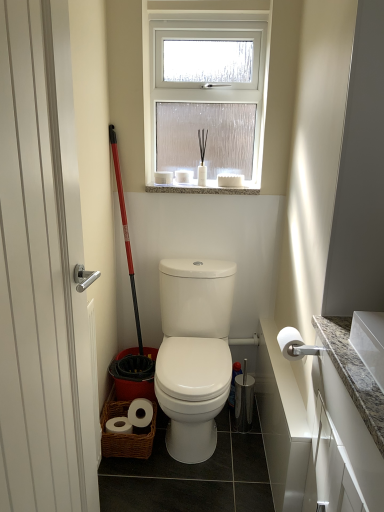
Question: Can you confirm if white matte toilet paper at right is shorter than white granite countertop at right?

Choices:
 (A) yes
 (B) no

Answer: (A)

Question: Is white matte toilet paper at right taller than white granite countertop at right?

Choices:
 (A) yes
 (B) no

Answer: (B)

Question: Does white matte toilet paper at right lie in front of white granite countertop at right?

Choices:
 (A) yes
 (B) no

Answer: (B)

Question: From a real-world perspective, is white matte toilet paper at right over white granite countertop at right?

Choices:
 (A) yes
 (B) no

Answer: (A)

Question: Is the position of white matte toilet paper at right more distant than that of white granite countertop at right?

Choices:
 (A) no
 (B) yes

Answer: (B)

Question: Considering the positions of white matte toilet paper at right and granite at upper center in the image, is white matte toilet paper at right bigger or smaller than granite at upper center?

Choices:
 (A) small
 (B) big

Answer: (A)

Question: Considering the relative positions of white matte toilet paper at right and granite at upper center in the image provided, is white matte toilet paper at right to the left or to the right of granite at upper center?

Choices:
 (A) right
 (B) left

Answer: (A)

Question: In terms of height, does white matte toilet paper at right look taller or shorter compared to granite at upper center?

Choices:
 (A) short
 (B) tall

Answer: (B)

Question: From the image's perspective, is white matte toilet paper at right positioned above or below granite at upper center?

Choices:
 (A) above
 (B) below

Answer: (B)

Question: Considering their positions, is granite at upper center located in front of or behind white matte toilet paper at right?

Choices:
 (A) front
 (B) behind

Answer: (B)

Question: Considering the positions of granite at upper center and white matte toilet paper at right in the image, is granite at upper center bigger or smaller than white matte toilet paper at right?

Choices:
 (A) small
 (B) big

Answer: (B)

Question: Is granite at upper center taller or shorter than white matte toilet paper at right?

Choices:
 (A) tall
 (B) short

Answer: (B)

Question: Considering the positions of point (162, 187) and point (279, 338), is point (162, 187) closer or farther from the camera than point (279, 338)?

Choices:
 (A) farther
 (B) closer

Answer: (A)

Question: In terms of width, does red plastic ski pole at left look wider or thinner when compared to white granite countertop at right?

Choices:
 (A) thin
 (B) wide

Answer: (A)

Question: From the image's perspective, is red plastic ski pole at left located above or below white granite countertop at right?

Choices:
 (A) below
 (B) above

Answer: (B)